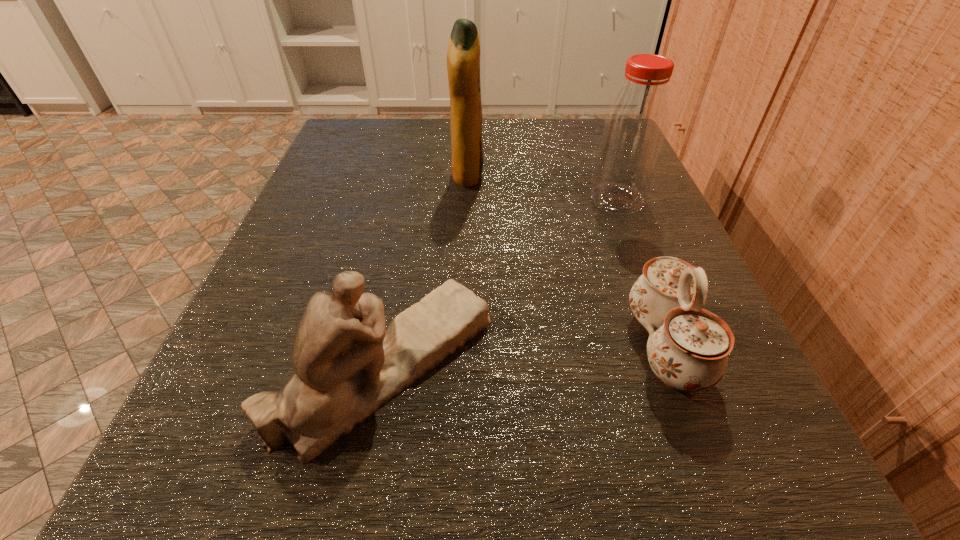
Find the location of a particular element. blank area at the far left corner is located at coordinates (375, 126).

Find the location of a particular element. Image resolution: width=960 pixels, height=540 pixels. vacant space at the far right corner of the desktop is located at coordinates (579, 158).

Where is `vacant space at the near right corner`? vacant space at the near right corner is located at coordinates (648, 482).

Identify the location of free point between the figurine and the bottle. The height and width of the screenshot is (540, 960). (501, 282).

The image size is (960, 540). In order to click on free spot between the bottle and the detergent in this screenshot , I will do `click(542, 187)`.

The width and height of the screenshot is (960, 540). Identify the location of vacant space that's between the second shortest object and the chinaware. (525, 356).

Image resolution: width=960 pixels, height=540 pixels. Find the location of `free space that is in between the bottle and the shortest object`. free space that is in between the bottle and the shortest object is located at coordinates (641, 273).

I want to click on free space between the detergent and the second shortest object, so click(x=426, y=270).

Image resolution: width=960 pixels, height=540 pixels. In order to click on unoccupied position between the chinaware and the bottle in this screenshot , I will do `click(641, 273)`.

You are a GUI agent. You are given a task and a screenshot of the screen. Output one action in this format:
    pyautogui.click(x=<x>, y=<y>)
    Task: Click on the free space that is in between the chinaware and the bottle
    The width and height of the screenshot is (960, 540).
    Given the screenshot: What is the action you would take?
    pyautogui.click(x=641, y=273)